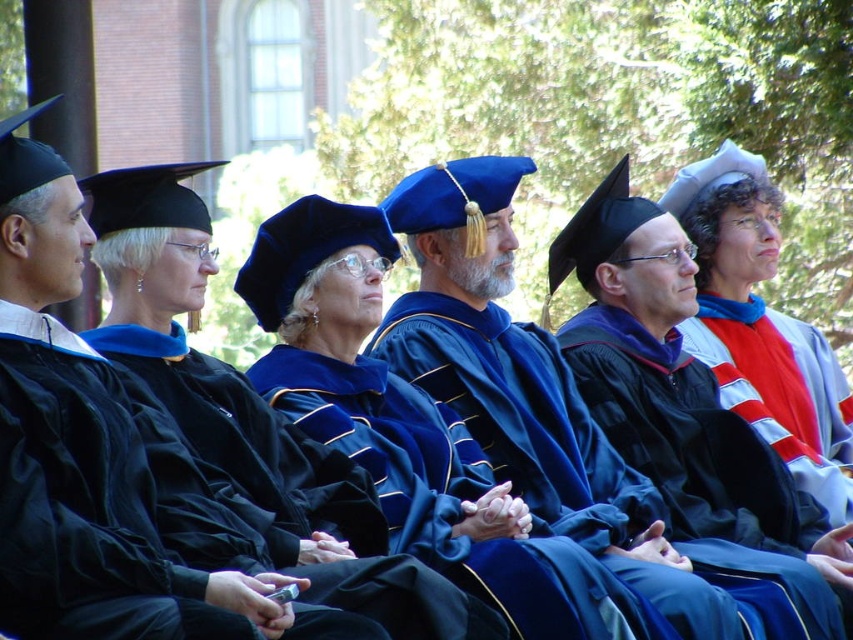
Question: Which point is farther to the camera?

Choices:
 (A) velvet blue gown at center
 (B) velvet blue graduation gown at center

Answer: (A)

Question: Can you confirm if velvet blue graduation gown at center is positioned above velvet blue gown at center?

Choices:
 (A) no
 (B) yes

Answer: (B)

Question: Which of the following is the farthest from the observer?

Choices:
 (A) (347, 512)
 (B) (729, 451)

Answer: (B)

Question: Which object is farther from the camera taking this photo?

Choices:
 (A) matte black graduation gown at center
 (B) velvet blue graduation gown at center
 (C) matte black gown at center

Answer: (A)

Question: Does velvet blue graduation gown at center have a greater width compared to matte black graduation gown at center?

Choices:
 (A) no
 (B) yes

Answer: (B)

Question: Can you confirm if velvet blue graduation gown at center is bigger than matte black graduation gown at center?

Choices:
 (A) no
 (B) yes

Answer: (A)